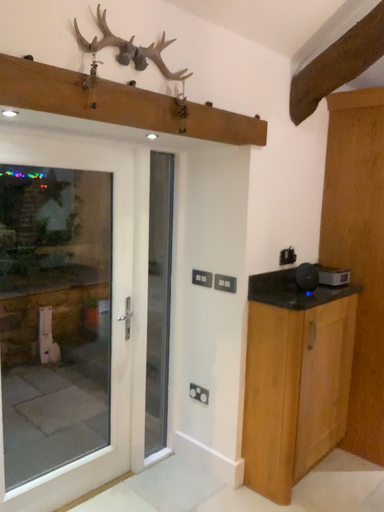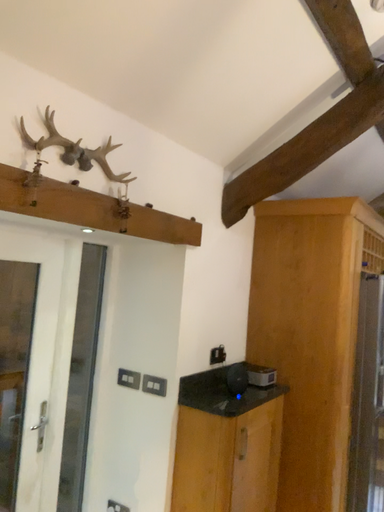
Question: Which way did the camera rotate in the video?

Choices:
 (A) rotated right
 (B) rotated left

Answer: (A)